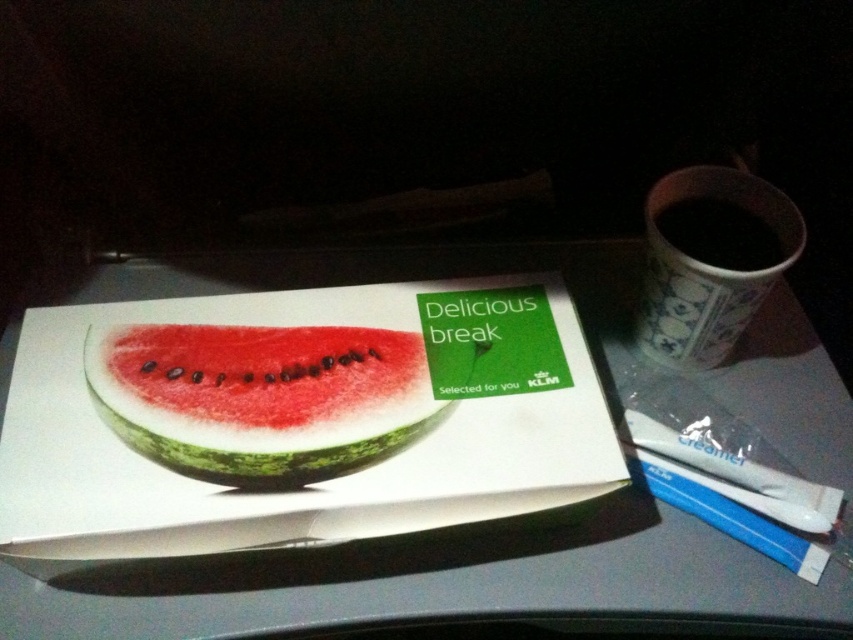
Who is more forward, (314, 618) or (663, 282)?

Point (314, 618)

Is point (787, 312) closer to camera compared to point (751, 195)?

No, it is not.

At what (x,y) coordinates should I click in order to perform the action: click on white plastic tray at center. Please return your answer as a coordinate pair (x, y). The width and height of the screenshot is (853, 640). Looking at the image, I should click on 451,586.

Does point (743, 625) lie behind point (419, 349)?

No, it is in front of (419, 349).

Measure the distance from white plastic tray at center to green matte watermelon at center.

A distance of 6.38 inches exists between white plastic tray at center and green matte watermelon at center.

You are a GUI agent. You are given a task and a screenshot of the screen. Output one action in this format:
    pyautogui.click(x=<x>, y=<y>)
    Task: Click on the white plastic tray at center
    The height and width of the screenshot is (640, 853).
    Given the screenshot: What is the action you would take?
    pyautogui.click(x=451, y=586)

Where is `white plastic tray at center`? white plastic tray at center is located at coordinates (451, 586).

Which is more to the left, green matte watermelon at center or black glossy cup at upper right?

From the viewer's perspective, green matte watermelon at center appears more on the left side.

Is green matte watermelon at center to the left of black glossy cup at upper right from the viewer's perspective?

Correct, you'll find green matte watermelon at center to the left of black glossy cup at upper right.

Identify the location of green matte watermelon at center. (260, 396).